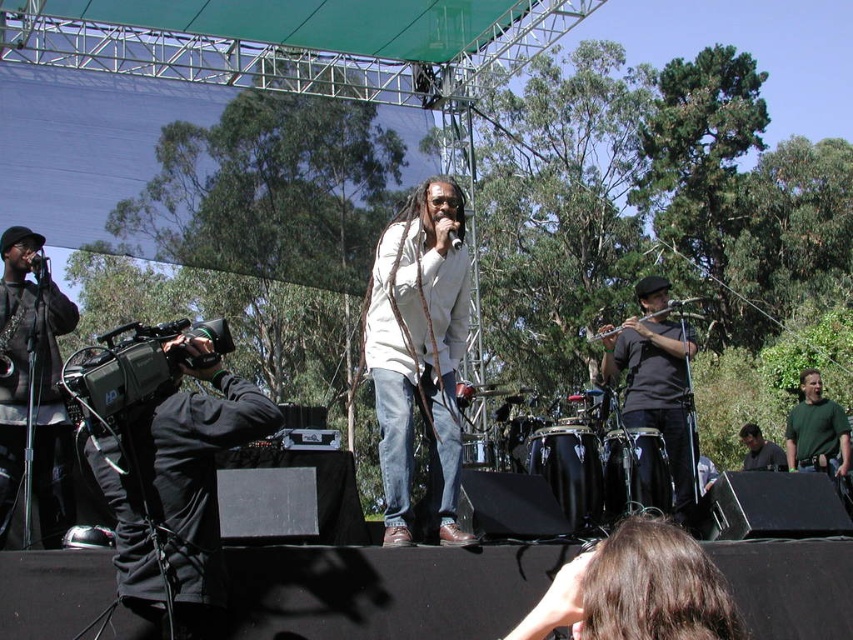
You are a photographer at the live music performance. You need to capture a photo that includes both the black matte shirt at right and the green matte shirt at right. Based on their positions, which one should you adjust your camera to focus on first to ensure both are in the frame?

Since the black matte shirt at right is to the left of the green matte shirt at right, you should focus on the black matte shirt at right first to ensure both are included in the frame.

You are a photographer at the live music performance. You need to capture a photo of both the black matte shirt at right and the green matte shirt at right. Which shirt should you focus on first to ensure both are in the frame?

The black matte shirt at right is above the green matte shirt at right, so focus on the black matte shirt at right first to ensure both are in the frame.

Consider the image. Based on the coordinates provided, which object corresponds to the point at [33,387]?

The point at [33,387] corresponds to the black matte jacket at left.